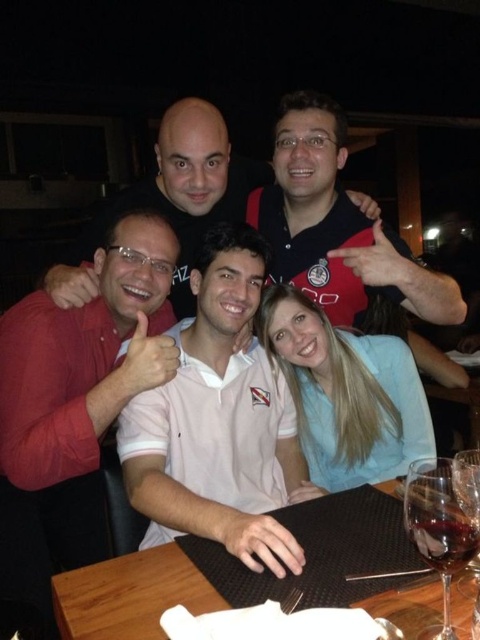
Question: Which of the following is the closest to the observer?

Choices:
 (A) (455, 540)
 (B) (431, 372)
 (C) (460, 464)
 (D) (223, 384)

Answer: (A)

Question: Which of the following is the farthest from the observer?

Choices:
 (A) (460, 625)
 (B) (451, 625)
 (C) (458, 458)

Answer: (C)

Question: Which of the following is the closest to the observer?

Choices:
 (A) matte red polo shirt at center
 (B) transparent glass wine at lower right

Answer: (B)

Question: Is brown wooden table at center thinner than transparent glass at table center?

Choices:
 (A) no
 (B) yes

Answer: (A)

Question: Is pink cotton polo shirt at center wider than matte red polo shirt at center?

Choices:
 (A) no
 (B) yes

Answer: (A)

Question: Can you confirm if pink cotton polo shirt at center is smaller than transparent glass wine glass at lower right?

Choices:
 (A) no
 (B) yes

Answer: (A)